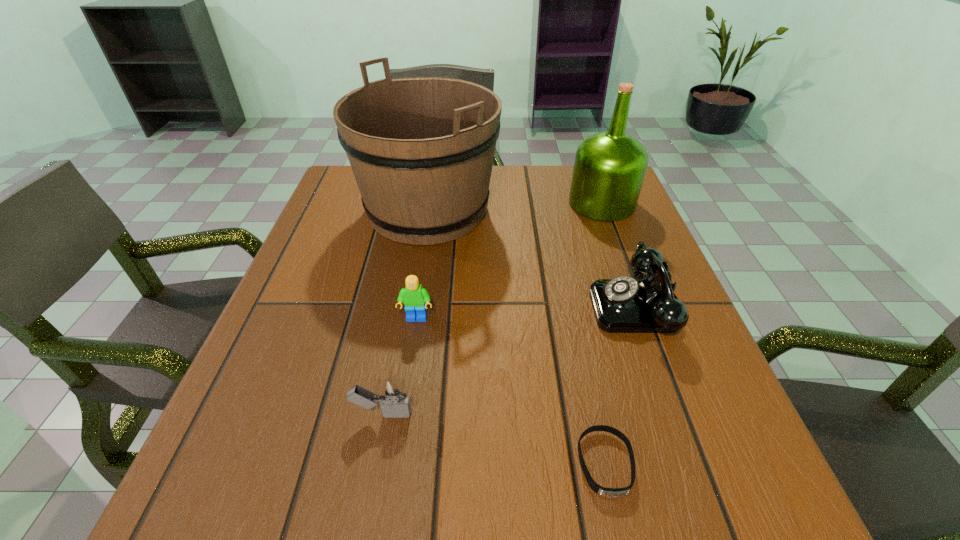
Where is `object at the far left corner`? The height and width of the screenshot is (540, 960). object at the far left corner is located at coordinates (421, 149).

This screenshot has width=960, height=540. I want to click on object at the far right corner, so click(609, 168).

The image size is (960, 540). Identify the location of vacant space at the far edge of the desktop. (493, 169).

In order to click on vacant space at the left edge of the desktop in this screenshot , I will do `click(309, 285)`.

You are a GUI agent. You are given a task and a screenshot of the screen. Output one action in this format:
    pyautogui.click(x=<x>, y=<y>)
    Task: Click on the vacant space at the right edge of the desktop
    
    Given the screenshot: What is the action you would take?
    pyautogui.click(x=612, y=263)

In the image, there is a desktop. Identify the location of free space at the far left corner. The image size is (960, 540). (349, 193).

In the image, there is a desktop. Identify the location of vacant space at the near left corner. Image resolution: width=960 pixels, height=540 pixels. (252, 511).

In the image, there is a desktop. Where is `vacant space at the near right corner`? vacant space at the near right corner is located at coordinates (771, 485).

Where is `vacant space that is in between the fifth farthest object and the wristband`? The width and height of the screenshot is (960, 540). vacant space that is in between the fifth farthest object and the wristband is located at coordinates (494, 438).

Find the location of a particular element. The width and height of the screenshot is (960, 540). vacant area between the olive oil and the bucket is located at coordinates pyautogui.click(x=515, y=207).